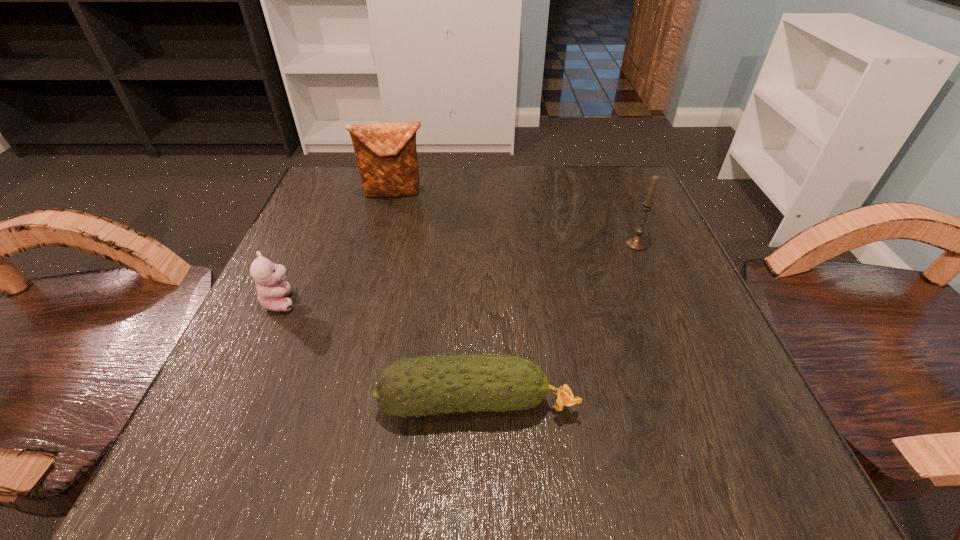
Locate an element on the screen. This screenshot has height=540, width=960. vacant space situated at the blossom end of the shortest object is located at coordinates (722, 402).

Find the location of `object that is at the far edge`. object that is at the far edge is located at coordinates (386, 154).

Where is `object that is positioned at the near edge`? This screenshot has width=960, height=540. object that is positioned at the near edge is located at coordinates [424, 385].

You are a GUI agent. You are given a task and a screenshot of the screen. Output one action in this format:
    pyautogui.click(x=<x>, y=<y>)
    Task: Click on the clutch bag that is at the left edge
    Image resolution: width=960 pixels, height=540 pixels.
    Given the screenshot: What is the action you would take?
    pyautogui.click(x=386, y=154)

The width and height of the screenshot is (960, 540). Identify the location of teddy bear positioned at the left edge. (269, 278).

Locate an element on the screen. The width and height of the screenshot is (960, 540). object that is at the right edge is located at coordinates (637, 242).

Locate an element on the screen. This screenshot has width=960, height=540. object that is at the far left corner is located at coordinates (386, 154).

Where is `free region at the far edge of the desktop`? free region at the far edge of the desktop is located at coordinates (538, 174).

I want to click on free region at the near edge of the desktop, so click(x=431, y=476).

You are a GUI agent. You are given a task and a screenshot of the screen. Output one action in this format:
    pyautogui.click(x=<x>, y=<y>)
    Task: Click on the free space at the left edge of the desktop
    
    Given the screenshot: What is the action you would take?
    pyautogui.click(x=212, y=388)